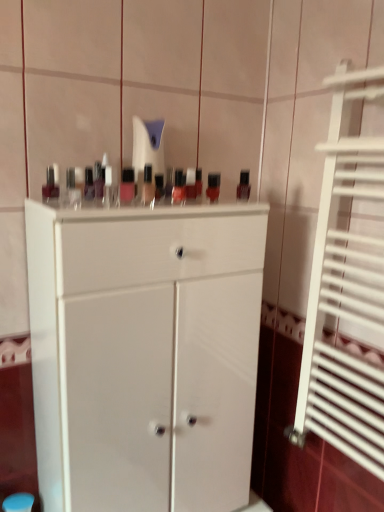
Question: In terms of width, does matte black nail polish at upper left, arranged as the 2th toiletry when viewed from the front, look wider or thinner when compared to matte black nail polish at upper center, which appears as the first mouthwash when viewed from the back?

Choices:
 (A) wide
 (B) thin

Answer: (A)

Question: Is matte black nail polish at upper left, arranged as the 2th toiletry when viewed from the front, to the left or to the right of matte black nail polish at upper center, marked as the first mouthwash in a right-to-left arrangement, in the image?

Choices:
 (A) left
 (B) right

Answer: (A)

Question: Considering the real-world distances, which object is closest to the white metal radiator at right?

Choices:
 (A) white matte cabinet at center
 (B) matte black nail polish at upper left, arranged as the 2th toiletry when viewed from the front
 (C) matte black nail polish at upper center, placed as the 3th mouthwash when sorted from front to back
 (D) matte plastic mouthwash at center, marked as the 2th mouthwash in a front-to-back arrangement
 (E) matte plastic nail polish bottles at center, the second toiletry viewed from the back

Answer: (A)

Question: Considering the real-world distances, which object is closest to the white metal radiator at right?

Choices:
 (A) white matte cabinet at center
 (B) matte plastic nail polish bottles at center, the second toiletry viewed from the back
 (C) matte black bottle at left, which is the 3th mouthwash from back to front
 (D) matte black nail polish at upper center, which is counted as the third mouthwash, starting from the left
 (E) matte plastic mouthwash at center, arranged as the 2th mouthwash when viewed from the back

Answer: (A)